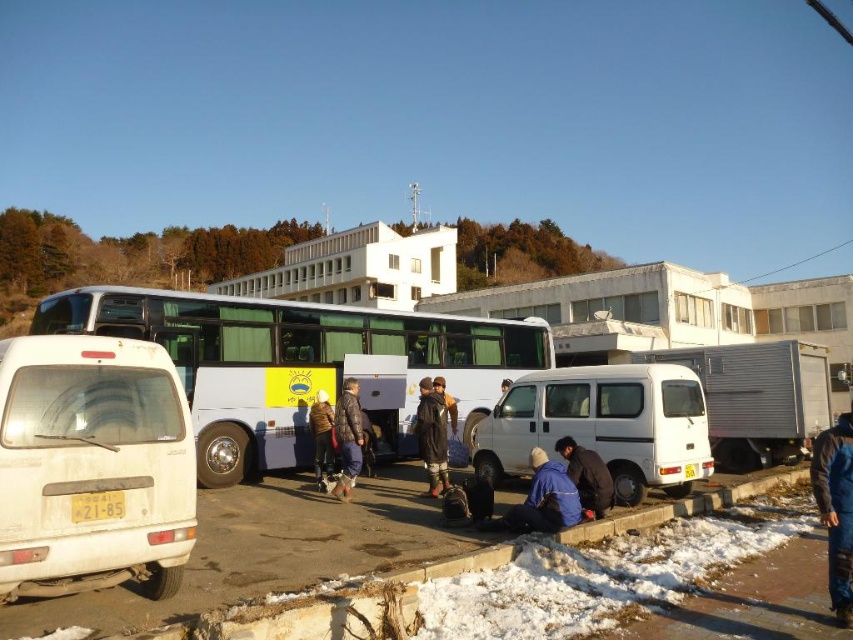
Question: Which object is farther from the camera taking this photo?

Choices:
 (A) dark blue jacket at lower center
 (B) blue waterproof jacket at lower right

Answer: (A)

Question: Is blue fabric jacket at lower center to the right of brown leather jacket at center from the viewer's perspective?

Choices:
 (A) yes
 (B) no

Answer: (A)

Question: Does white matte bus at center appear on the left side of white matte van at left?

Choices:
 (A) yes
 (B) no

Answer: (B)

Question: Which point appears closest to the camera in this image?

Choices:
 (A) (576, 499)
 (B) (596, 513)
 (C) (73, 406)
 (D) (315, 429)

Answer: (C)

Question: Does white matte bus at center appear on the right side of dark blue jacket at center?

Choices:
 (A) yes
 (B) no

Answer: (A)

Question: Which object is farther from the camera taking this photo?

Choices:
 (A) white matte van at center
 (B) white matte bus at center
 (C) brown leather jacket at center

Answer: (C)